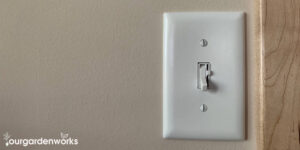
Identify the location of switchplate. This screenshot has width=300, height=150. coord(221,53).